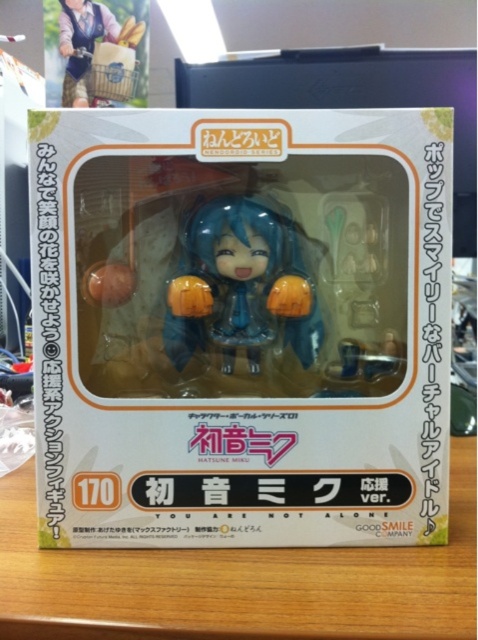
Between white matte box at center and matte brown wooden basket at upper left, which one appears on the right side from the viewer's perspective?

Positioned to the right is white matte box at center.

Between white matte box at center and matte brown wooden basket at upper left, which one appears on the left side from the viewer's perspective?

matte brown wooden basket at upper left is more to the left.

Between point (297, 296) and point (86, 54), which one is positioned behind?

Positioned behind is point (86, 54).

The width and height of the screenshot is (478, 640). What are the coordinates of `white matte box at center` in the screenshot? It's located at (240, 326).

The width and height of the screenshot is (478, 640). I want to click on yellow matte table at center, so click(x=239, y=582).

Who is taller, yellow matte table at center or matte blue figure at center?

matte blue figure at center is taller.

Between point (206, 570) and point (195, 228), which one is positioned in front?

Point (206, 570) is more forward.

Where is `yellow matte table at center`? yellow matte table at center is located at coordinates (239, 582).

Between matte blue figure at center and matte brown wooden basket at upper left, which one has more height?

matte blue figure at center

Does matte blue figure at center have a larger size compared to matte brown wooden basket at upper left?

Indeed, matte blue figure at center has a larger size compared to matte brown wooden basket at upper left.

This screenshot has width=478, height=640. What do you see at coordinates (241, 284) in the screenshot? I see `matte blue figure at center` at bounding box center [241, 284].

I want to click on matte blue figure at center, so click(x=241, y=284).